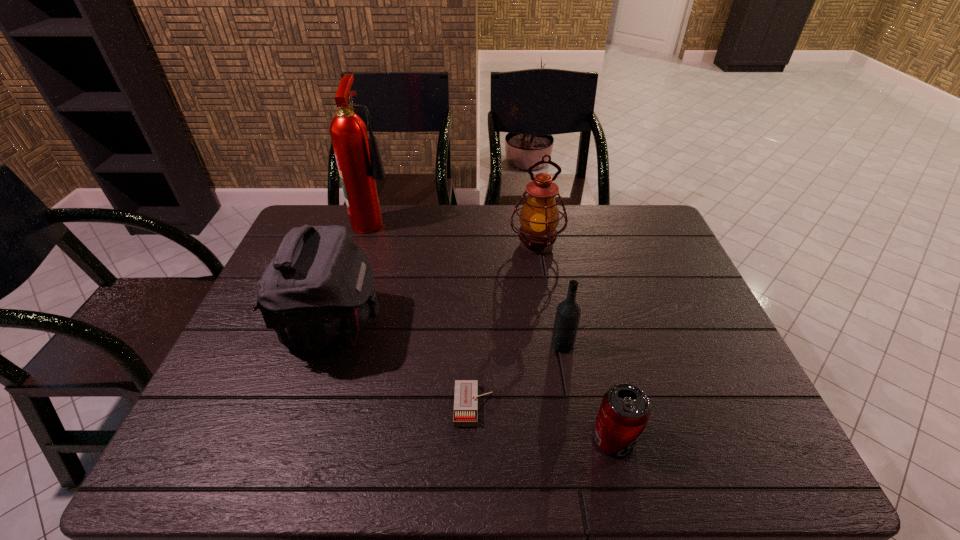
In order to click on empty location between the shoulder bag and the third shortest object in this screenshot , I will do `click(448, 335)`.

Where is `empty location between the fourth object from right to left and the oil lamp`? empty location between the fourth object from right to left and the oil lamp is located at coordinates (505, 325).

The width and height of the screenshot is (960, 540). What are the coordinates of `vacant area that lies between the oil lamp and the matchbox` in the screenshot? It's located at (505, 325).

Locate an element on the screen. object that is the fourth closest to the soda can is located at coordinates [x=539, y=217].

Identify which object is located as the fourth nearest to the shoulder bag. Please provide its 2D coordinates. Your answer should be formatted as a tuple, i.e. [(x, y)], where the tuple contains the x and y coordinates of a point satisfying the conditions above.

[(568, 312)]

Identify the location of free location that satisfies the following two spatial constraints: 1. on the open flap of the vodka; 2. on the left side of the shoulder bag. The width and height of the screenshot is (960, 540). (327, 345).

Find the location of a particular element. The height and width of the screenshot is (540, 960). vacant area that satisfies the following two spatial constraints: 1. on the front side of the oil lamp; 2. on the right side of the vodka is located at coordinates (552, 345).

The height and width of the screenshot is (540, 960). I want to click on free space that satisfies the following two spatial constraints: 1. on the open flap of the shoulder bag; 2. on the back side of the third shortest object, so click(327, 345).

This screenshot has height=540, width=960. I want to click on free space that satisfies the following two spatial constraints: 1. on the back side of the third shortest object; 2. on the open flap of the shoulder bag, so click(560, 327).

Where is `vacant space that satisfies the following two spatial constraints: 1. on the open flap of the soda can; 2. on the left side of the shoulder bag`? Image resolution: width=960 pixels, height=540 pixels. vacant space that satisfies the following two spatial constraints: 1. on the open flap of the soda can; 2. on the left side of the shoulder bag is located at coordinates (297, 438).